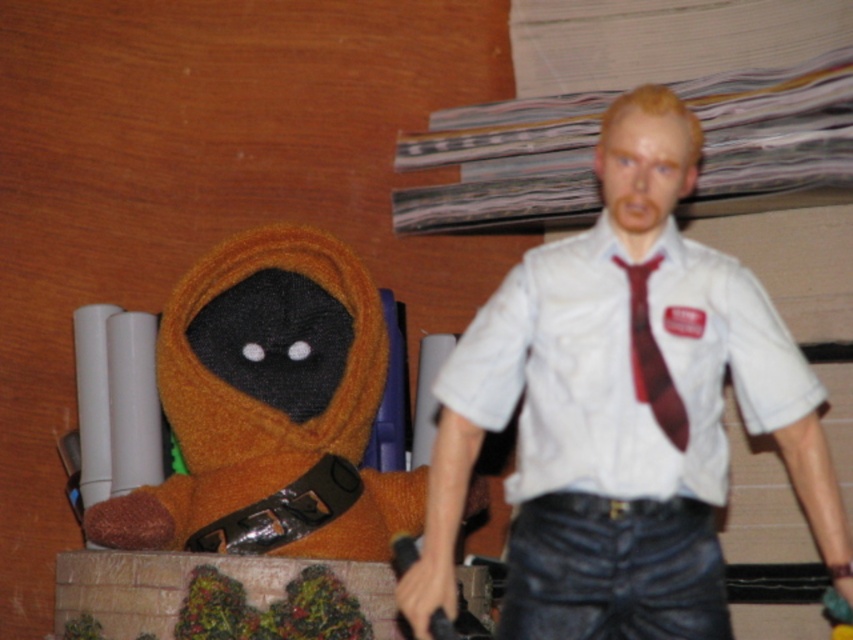
You are designing a display case for these two items. The case has a shelf that can only support a width of 1 meter. If the white matte shirt at upper right and the matte red tie at center are placed side by side horizontally, will they fit within the shelf width?

The white matte shirt at upper right might be wider than matte red tie at center, so their combined width could exceed the 1 meter limit. It is uncertain if they will fit without knowing the exact widths.

You are an observer looking at the image. Where is the white matte shirt at upper right located in terms of coordinates?

The white matte shirt at upper right is located at coordinates point (622, 410).